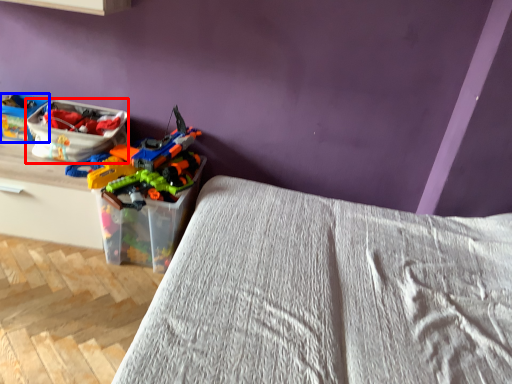
Question: Which object is closer to the camera taking this photo, kit (highlighted by a red box) or kit (highlighted by a blue box)?

Choices:
 (A) kit
 (B) kit

Answer: (A)